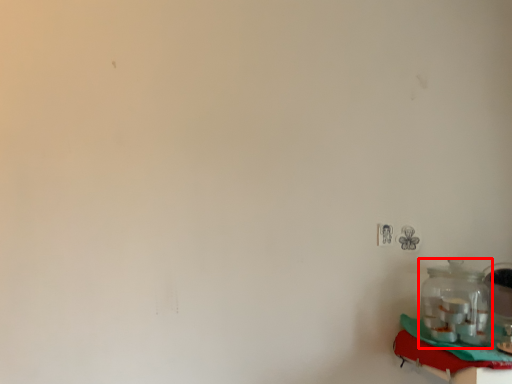
Question: From the image's perspective, what is the correct spatial positioning of bottle (annotated by the red box) in reference to table?

Choices:
 (A) above
 (B) below

Answer: (A)